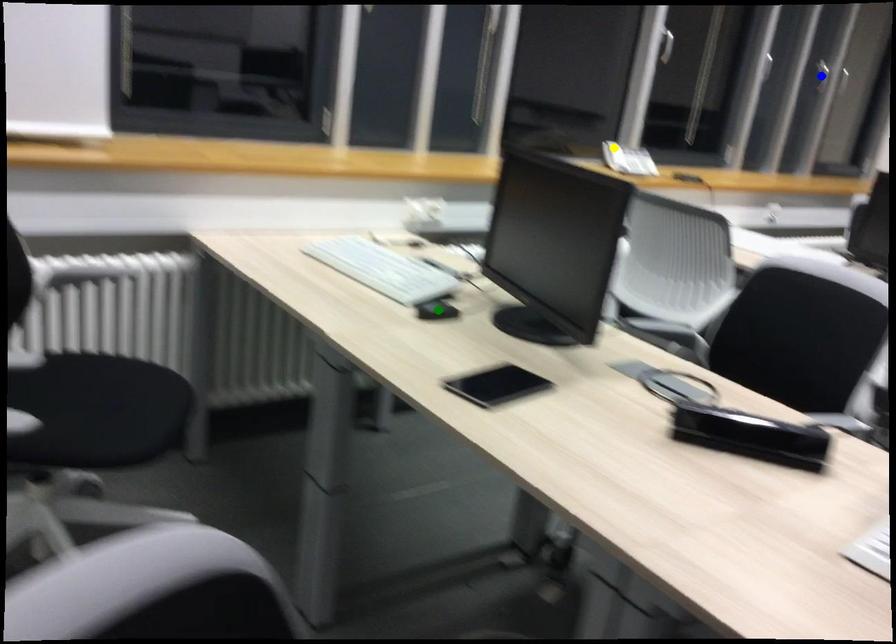
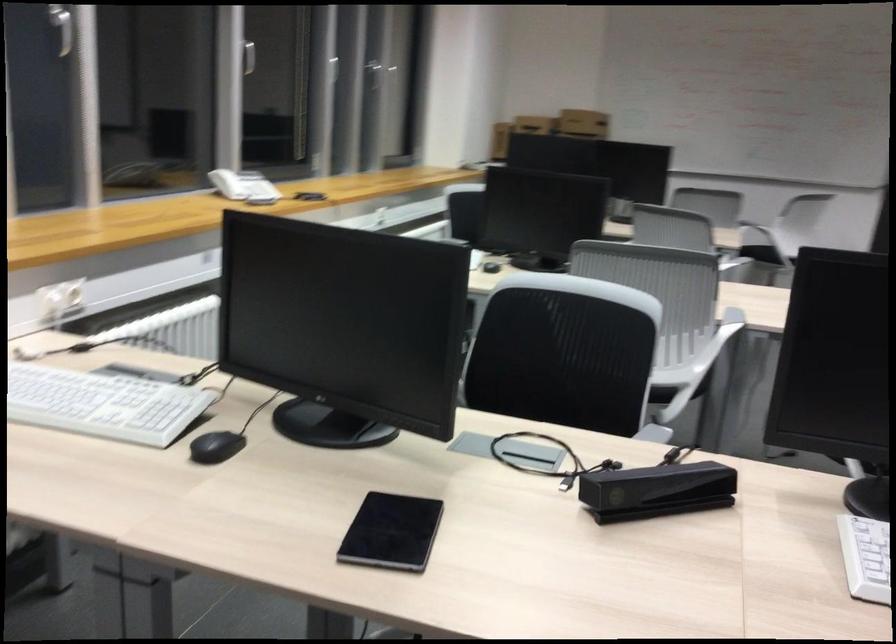
I am providing you with two images of the same scene from different viewpoints. Three points are marked in image1. Which point corresponds to a part or object that is occluded in image2?In image1, three points are marked. Which of them correspond to a part or object that is occluded in image2?Among the three points shown in image1, which one corresponds to a part or object that is no longer visible due to occlusion in image2?

blue point